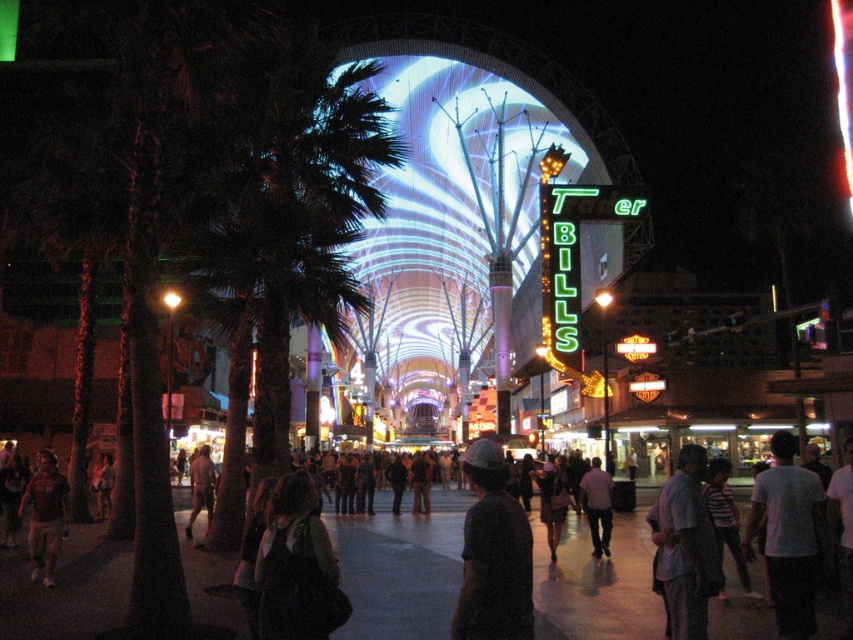
You are a photographer trying to capture a photo of the light purple shirt at center without the green leafy palm tree at left blocking the view. Can you do this?

The green leafy palm tree at left is taller than the light purple shirt at center, so the palm tree may block the view of the light purple shirt at center depending on the angle and distance. To avoid obstruction, position yourself lower or move closer to the light purple shirt at center so that the palm tree is out of frame or behind the subject.

You are standing at the point with coordinates point (x=199, y=461) and want to walk towards the point with coordinates point (x=39, y=529). In which direction should you move?

You should move forward because point (x=39, y=529) is in front of point (x=199, y=461).

You are standing at the center of the pathway in the urban area. You want to reach the skinny nude man at lower left but need to avoid walking through the green leafy palm tree at left. Is there enough space between them for you to pass through?

The green leafy palm tree at left is 72.69 feet away from the skinny nude man at lower left, so there is sufficient space to walk around the palm tree and reach the skinny nude man at lower left without obstruction.